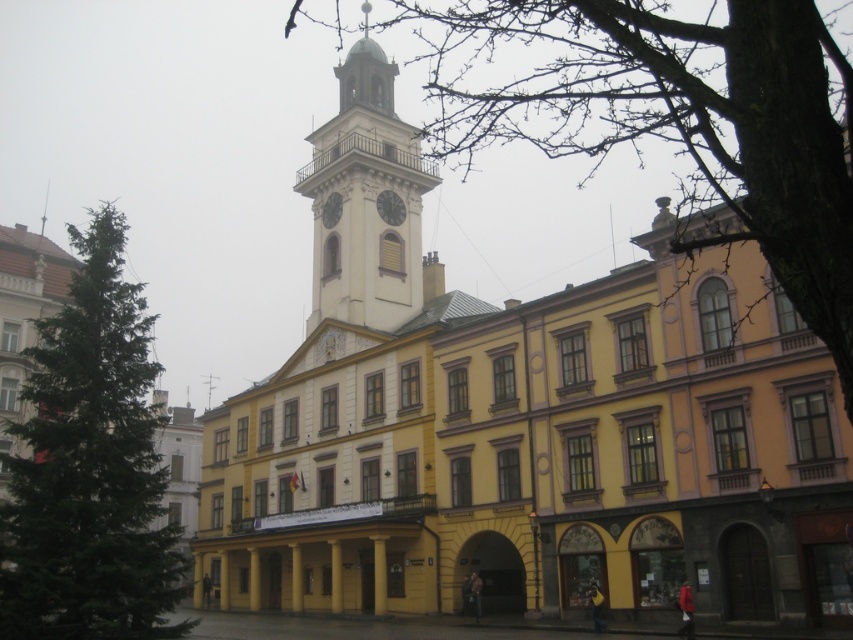
You are standing in front of a historic building with a clock tower. The white stone clock tower at center is part of this building. If you want to take a photo that includes both the entire clock tower and the main building facade, would you need to move closer or farther away?

The white stone clock tower at center is 259.75 feet from viewer. To include both the entire clock tower and the main building facade in a single photo, you would need to move farther away to capture the full view.

You are a drone operator tasked with capturing aerial footage of the historic building. Your drone must fly from the bare wood tree at upper center to the matte white clock at center. Given that your drone has a maximum flight range of 150 feet before needing to return, will it be able to complete this mission without needing to recharge?

The distance between the bare wood tree at upper center and the matte white clock at center is 162.63 feet. Since the drone can only fly 150 feet before needing to return, it will not be able to complete the mission without recharging.